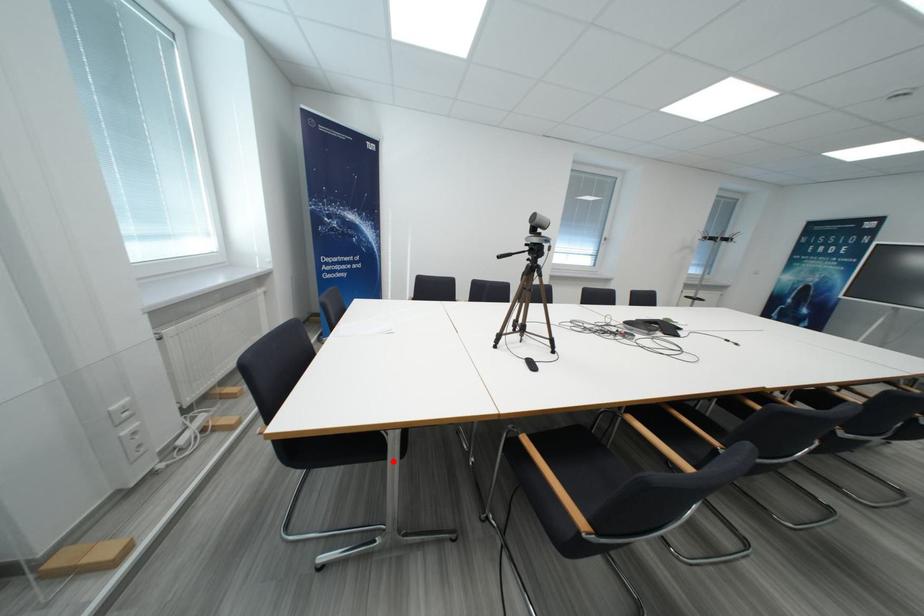
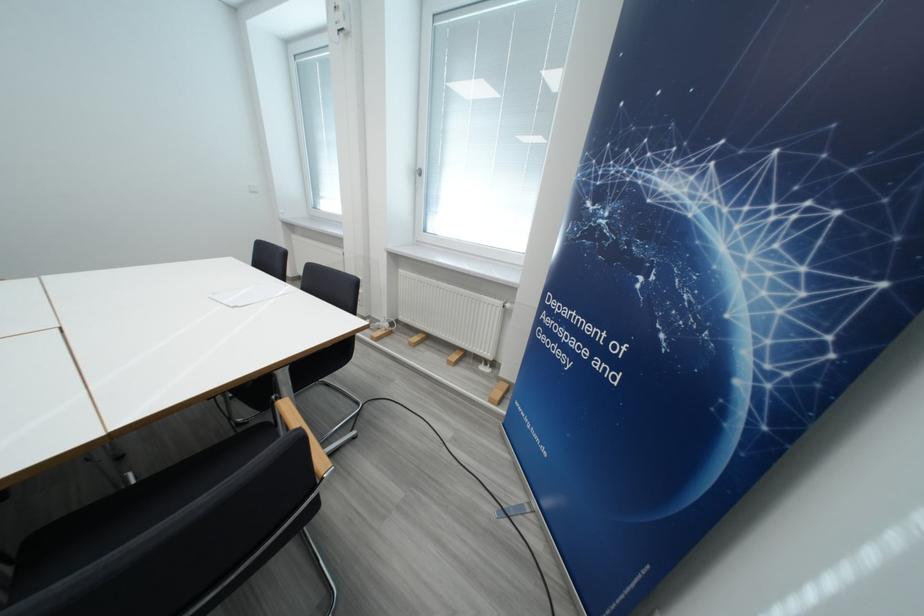
Question: I am providing you with two images of the same scene from different viewpoints. A red point is marked on the first image. Is the red point's position out of view in image 2?

Choices:
 (A) Yes
 (B) No

Answer: (A)